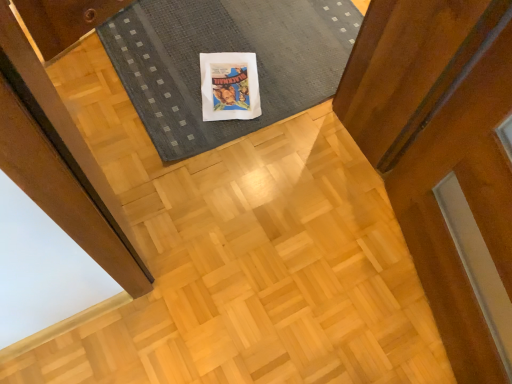
Identify the location of free region on the left part of matte white comic book at center. The width and height of the screenshot is (512, 384). (168, 79).